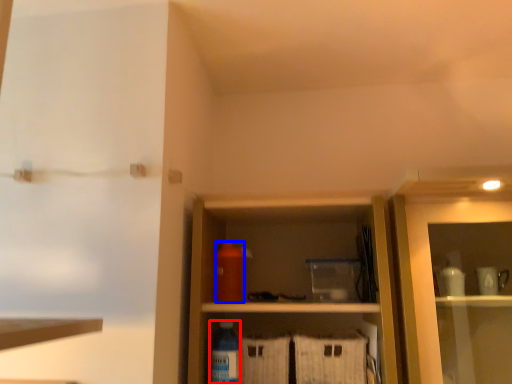
Question: Which object appears farthest to the camera in this image, bottle (highlighted by a red box) or bottle (highlighted by a blue box)?

Choices:
 (A) bottle
 (B) bottle

Answer: (B)